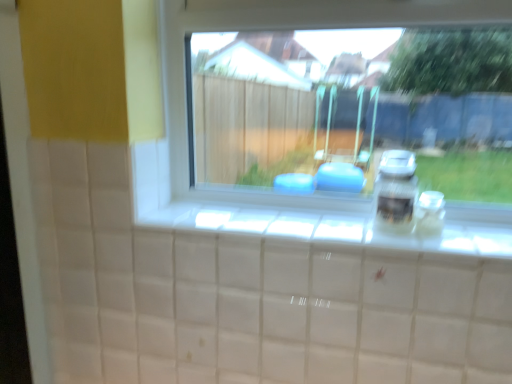
Locate an element on the screen. vacant region to the left of satin silver jar at right is located at coordinates (333, 236).